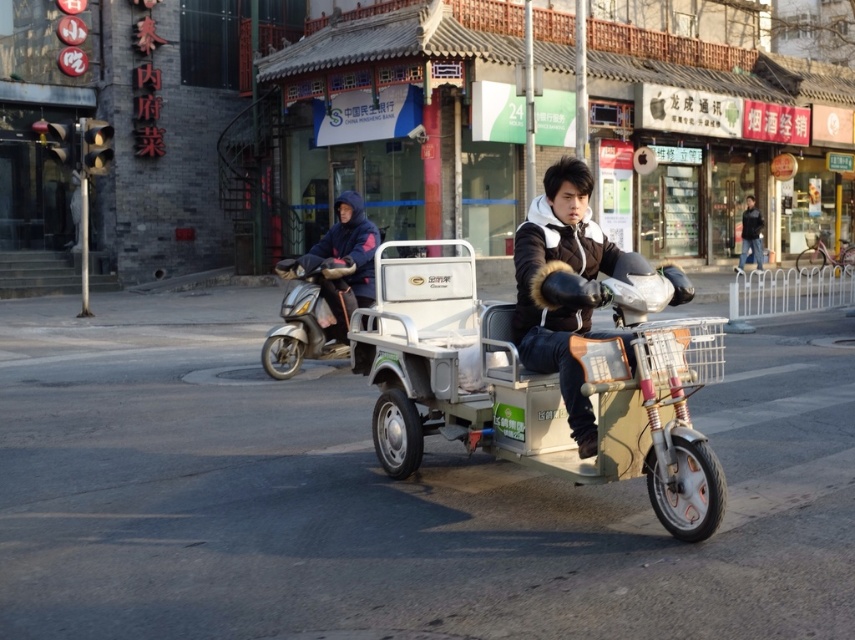
Can you confirm if metallic silver cart at center is bigger than black fuzzy jacket at center?

Yes, metallic silver cart at center is bigger than black fuzzy jacket at center.

The image size is (855, 640). What are the coordinates of `metallic silver cart at center` in the screenshot? It's located at (541, 380).

Who is higher up, shiny metallic scooter at center-left or dark blue jacket at center?

dark blue jacket at center

Is point (286, 371) farther from viewer compared to point (358, 236)?

That is False.

This screenshot has width=855, height=640. I want to click on shiny metallic scooter at center-left, so click(310, 314).

Which is more to the right, shiny metallic scooter at center-left or black leather jacket at upper right?

black leather jacket at upper right is more to the right.

Is point (281, 269) behind point (758, 252)?

That is False.

Where is `shiny metallic scooter at center-left`? Image resolution: width=855 pixels, height=640 pixels. shiny metallic scooter at center-left is located at coordinates (310, 314).